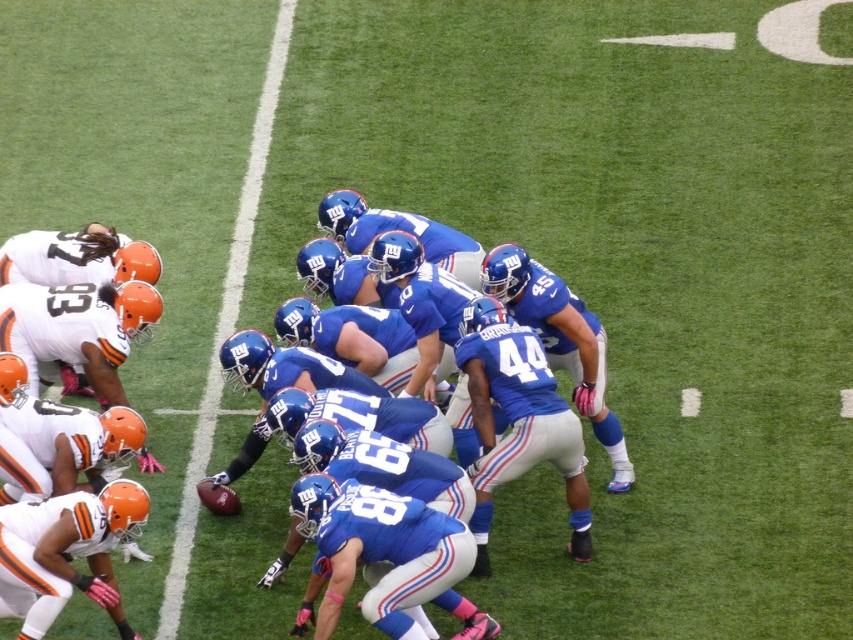
Question: Which point is farther to the camera?

Choices:
 (A) (91, 392)
 (B) (291, 323)

Answer: (A)

Question: Is blue fabric jersey at center in front of matte orange helmet at left?

Choices:
 (A) no
 (B) yes

Answer: (A)

Question: Which object is the closest to the white matte uniform at lower left?

Choices:
 (A) blue fabric jersey at center
 (B) matte orange helmet at left

Answer: (B)

Question: Does blue fabric jersey at center have a smaller size compared to white matte uniform at lower left?

Choices:
 (A) yes
 (B) no

Answer: (B)

Question: Can you confirm if white matte uniform at lower left is positioned below matte orange helmet at left?

Choices:
 (A) no
 (B) yes

Answer: (B)

Question: Which object is farther from the camera taking this photo?

Choices:
 (A) blue fabric jersey at center
 (B) matte orange helmet at left

Answer: (A)